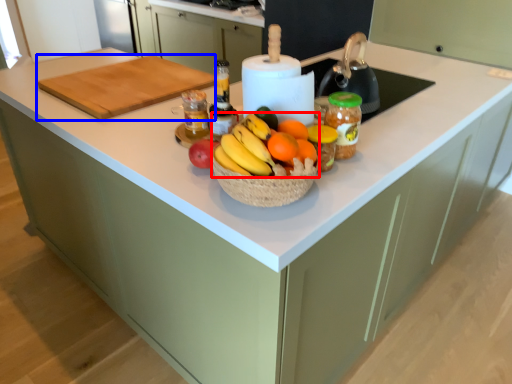
Question: Which point is closer to the camera, grapefruit (highlighted by a red box) or cutting board (highlighted by a blue box)?

Choices:
 (A) grapefruit
 (B) cutting board

Answer: (A)